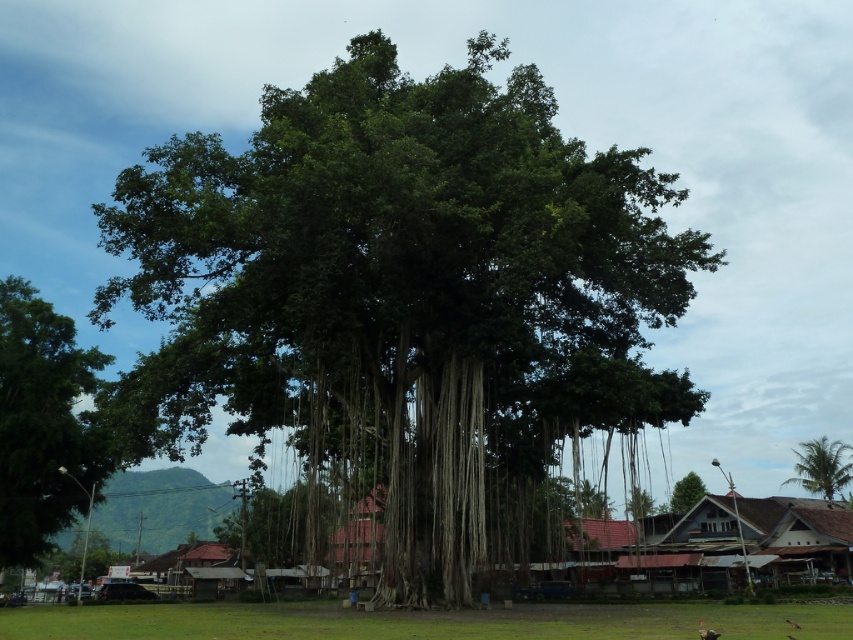
Can you confirm if green leafy tree at left is wider than green leafy tree at upper right?

No.

Who is more forward, (15,346) or (840,444)?

Point (15,346) is more forward.

Which is in front, point (12, 349) or point (834, 464)?

Point (12, 349)

I want to click on green leafy tree at left, so click(42, 422).

Is green grass at lower center to the right of green leafy tree at center from the viewer's perspective?

Incorrect, green grass at lower center is not on the right side of green leafy tree at center.

Between green grass at lower center and green leafy tree at center, which one is positioned higher?

green grass at lower center

Is point (753, 636) positioned after point (674, 499)?

That is False.

I want to click on green grass at lower center, so click(x=422, y=621).

Can you confirm if green grass at lower center is wider than green leafy tree at upper right?

Indeed, green grass at lower center has a greater width compared to green leafy tree at upper right.

Between point (602, 618) and point (807, 480), which one is positioned behind?

Point (807, 480)

Locate an element on the screen. The image size is (853, 640). green grass at lower center is located at coordinates (422, 621).